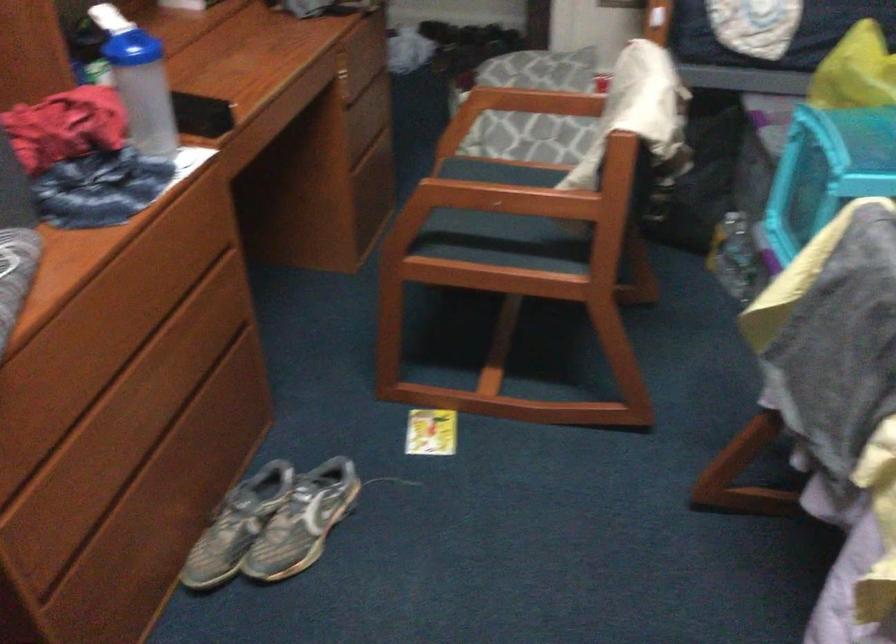
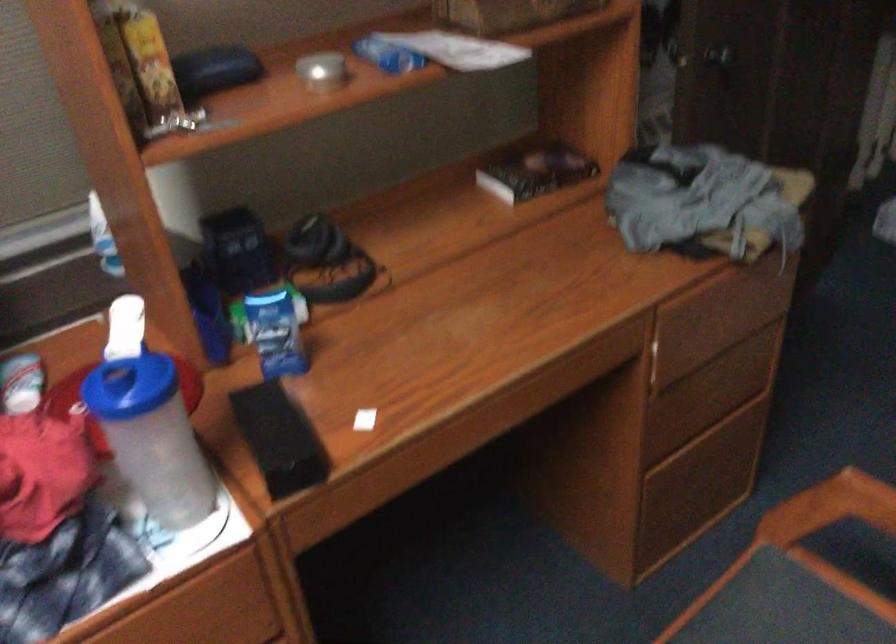
The point at (161,84) is marked in the first image. Where is the corresponding point in the second image?

(151, 437)